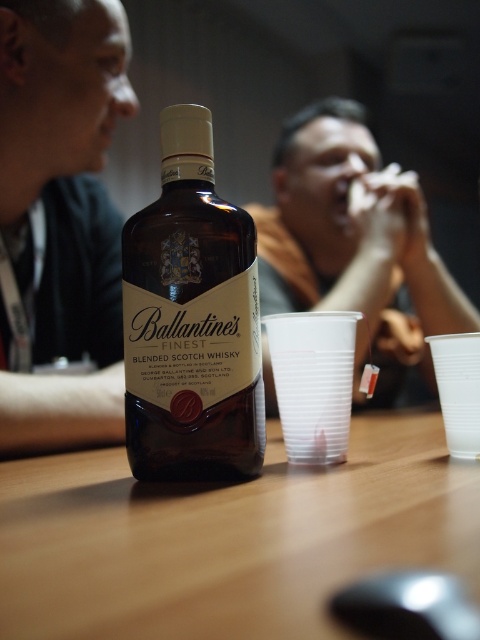
Looking at this image, is smooth skin face at upper left thinner than orange cotton shirt at center?

Indeed, smooth skin face at upper left has a lesser width compared to orange cotton shirt at center.

In order to click on smooth skin face at upper left in this screenshot , I will do `click(58, 99)`.

Between point (97, 80) and point (354, 220), which one is positioned behind?

The point (354, 220) is more distant.

Image resolution: width=480 pixels, height=640 pixels. I want to click on smooth skin face at upper left, so click(x=58, y=99).

Does brown wooden table at center have a smaller size compared to orange cotton shirt at center?

Correct, brown wooden table at center occupies less space than orange cotton shirt at center.

Does brown wooden table at center lie behind orange cotton shirt at center?

No, it is in front of orange cotton shirt at center.

Identify the location of brown wooden table at center. (229, 538).

Is brown glass bottle at center smaller than transparent plastic cup at lower right?

No.

What do you see at coordinates (191, 321) in the screenshot? Image resolution: width=480 pixels, height=640 pixels. I see `brown glass bottle at center` at bounding box center [191, 321].

Is point (205, 186) less distant than point (460, 387)?

Yes, point (205, 186) is closer to viewer.

Identify the location of brown glass bottle at center. The height and width of the screenshot is (640, 480). (191, 321).